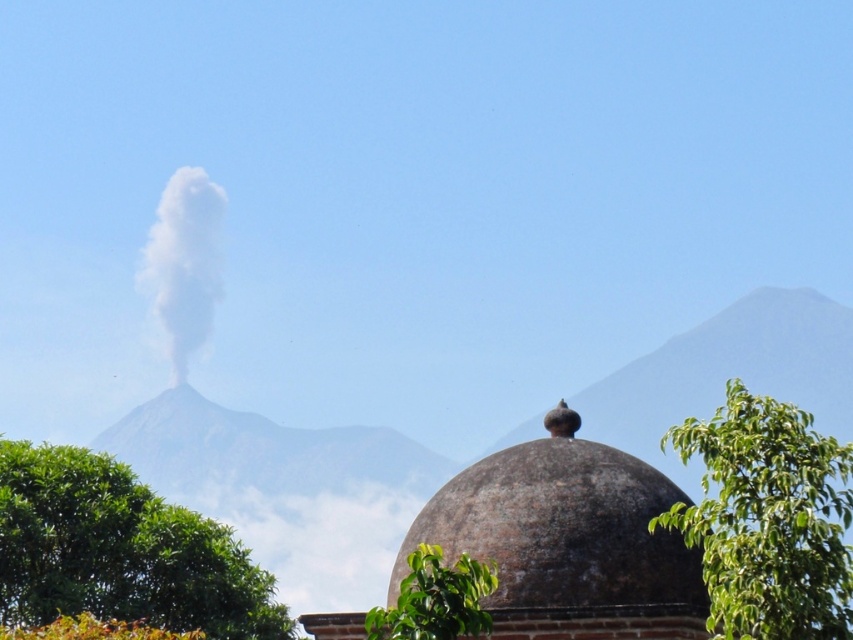
Does white smoke at center have a lesser height compared to green leafy tree at lower center?

No.

Is point (181, 244) positioned before point (424, 564)?

No.

Which is in front, point (177, 344) or point (469, 616)?

Point (469, 616) is more forward.

Identify the location of white smoke at center. The width and height of the screenshot is (853, 640). (184, 262).

Does green leafy tree at center appear under white smoke at center?

Indeed, green leafy tree at center is positioned under white smoke at center.

Does green leafy tree at center have a larger size compared to white smoke at center?

Correct, green leafy tree at center is larger in size than white smoke at center.

Locate an element on the screen. This screenshot has width=853, height=640. green leafy tree at center is located at coordinates (120, 552).

You are a GUI agent. You are given a task and a screenshot of the screen. Output one action in this format:
    pyautogui.click(x=<x>, y=<y>)
    Task: Click on the green leafy tree at center
    This screenshot has width=853, height=640.
    Given the screenshot: What is the action you would take?
    pyautogui.click(x=120, y=552)

Which is above, green leafy tree at center or green leafy tree at lower right?

green leafy tree at lower right is higher up.

Where is `green leafy tree at center`? This screenshot has height=640, width=853. green leafy tree at center is located at coordinates (120, 552).